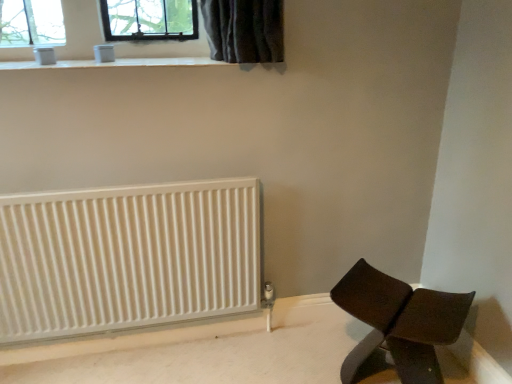
Question: From a real-world perspective, is brown leather chair at lower right above or below white ribbed radiator at lower left?

Choices:
 (A) above
 (B) below

Answer: (B)

Question: Considering the positions of brown leather chair at lower right and white ribbed radiator at lower left in the image, is brown leather chair at lower right taller or shorter than white ribbed radiator at lower left?

Choices:
 (A) short
 (B) tall

Answer: (A)

Question: Estimate the real-world distances between objects in this image. Which object is closer to the white smooth window sill at upper center?

Choices:
 (A) white ribbed radiator at lower left
 (B) brown leather chair at lower right

Answer: (A)

Question: Estimate the real-world distances between objects in this image. Which object is farther from the white ribbed radiator at lower left?

Choices:
 (A) white smooth window sill at upper center
 (B) brown leather chair at lower right

Answer: (B)